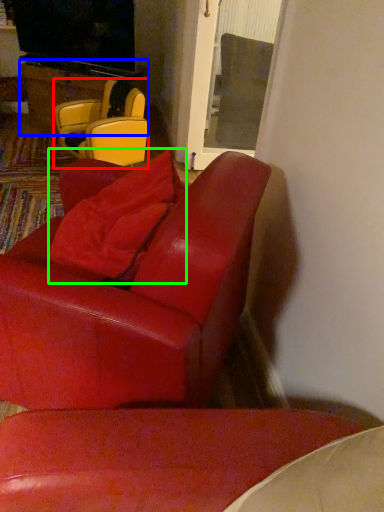
Question: Which object is positioned closest to chair (highlighted by a red box)? Select from table (highlighted by a blue box) and pillow (highlighted by a green box).

Choices:
 (A) table
 (B) pillow

Answer: (A)